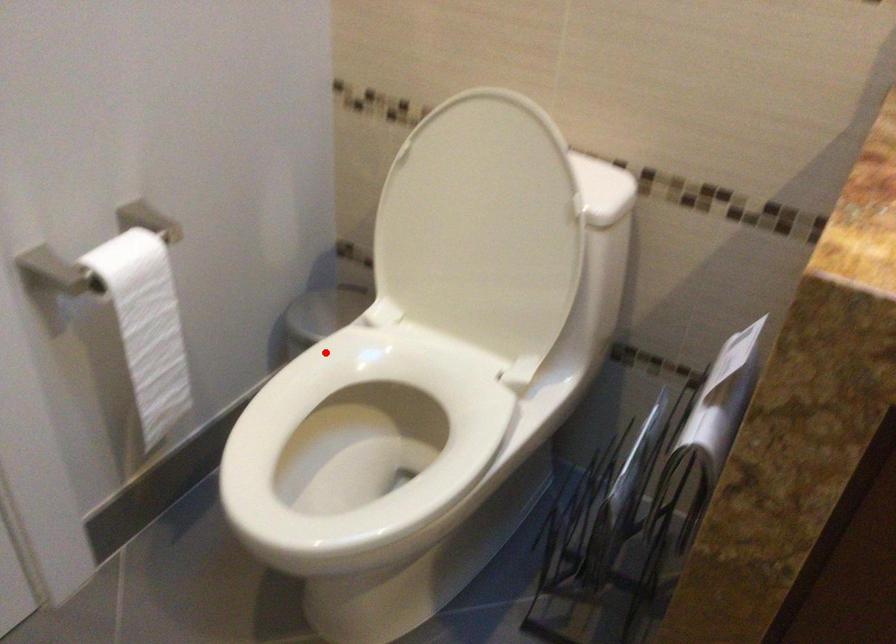
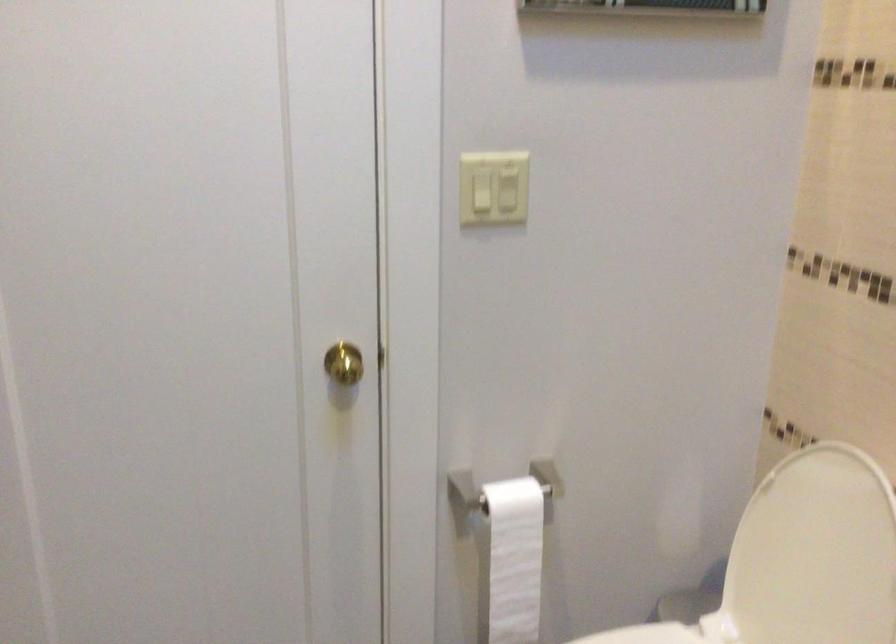
Find the pixel in the second image that matches the highlighted location in the first image.

(645, 635)